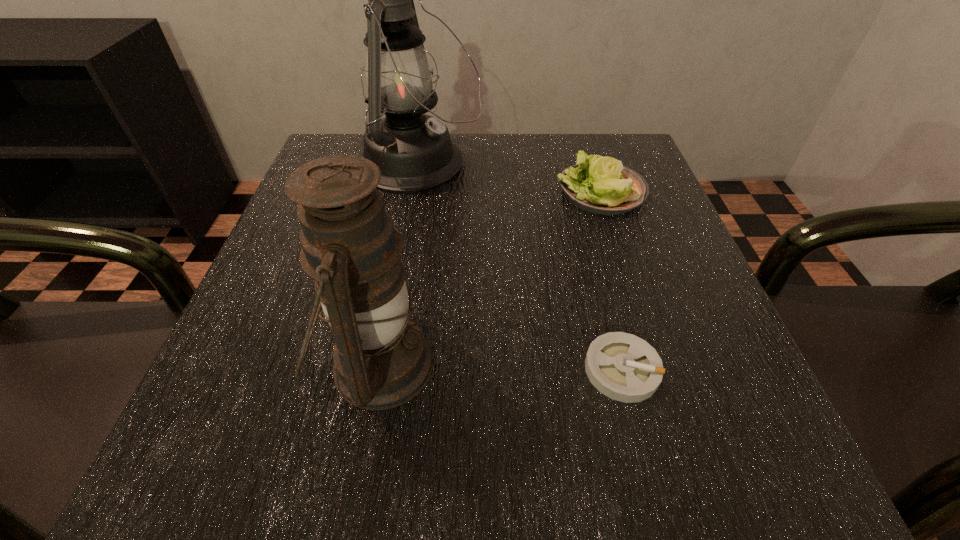
The image size is (960, 540). In order to click on the taller oil lamp in this screenshot , I will do `click(414, 152)`.

The image size is (960, 540). What are the coordinates of `the tallest object` in the screenshot? It's located at (414, 152).

The image size is (960, 540). I want to click on the shorter oil lamp, so 350,247.

I want to click on the nearer oil lamp, so click(350, 247).

Find the location of a particular element. The height and width of the screenshot is (540, 960). the third tallest object is located at coordinates (601, 185).

I want to click on the shortest object, so click(x=622, y=366).

This screenshot has height=540, width=960. I want to click on vacant region located 0.080m on the left of the farther oil lamp, so click(x=321, y=164).

Find the location of a particular element. Image resolution: width=960 pixels, height=540 pixels. free space located 0.130m on the left of the second tallest object is located at coordinates (231, 366).

The width and height of the screenshot is (960, 540). I want to click on free space located on the left of the second shortest object, so click(x=464, y=191).

The height and width of the screenshot is (540, 960). I want to click on vacant space positioned on the front of the shortest object, so click(x=646, y=465).